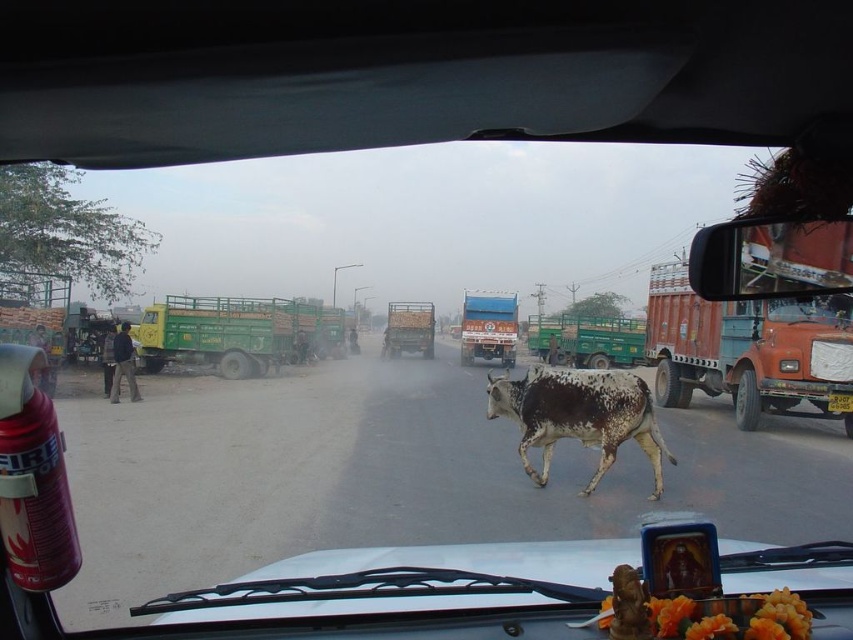
You are driving and see a speckled hide bull at center and a yellow plastic license plate at center in your view. Which object is closer to your eyes?

The speckled hide bull at center is closer to your eyes because it is shorter than the yellow plastic license plate at center, meaning it appears lower in the field of view.

You are driving and see a cow on the road ahead. The cow is represented by the point at (579, 416). Your car has a fire extinguisher on the left side of the dashboard and a decorative item with orange flowers on the right corner. If you need to swerve to avoid the cow, which side should you choose to have clear space for maneuvering?

You should swerve to the right side because the fire extinguisher is on the left side of the dashboard, so there is more space on the right side near the decorative item with orange flowers to maneuver safely.

You are driving a car and see a blue metallic truck at center at point [488,326]. Where is the blue metallic truck at center located?

The blue metallic truck at center is located at point [488,326].